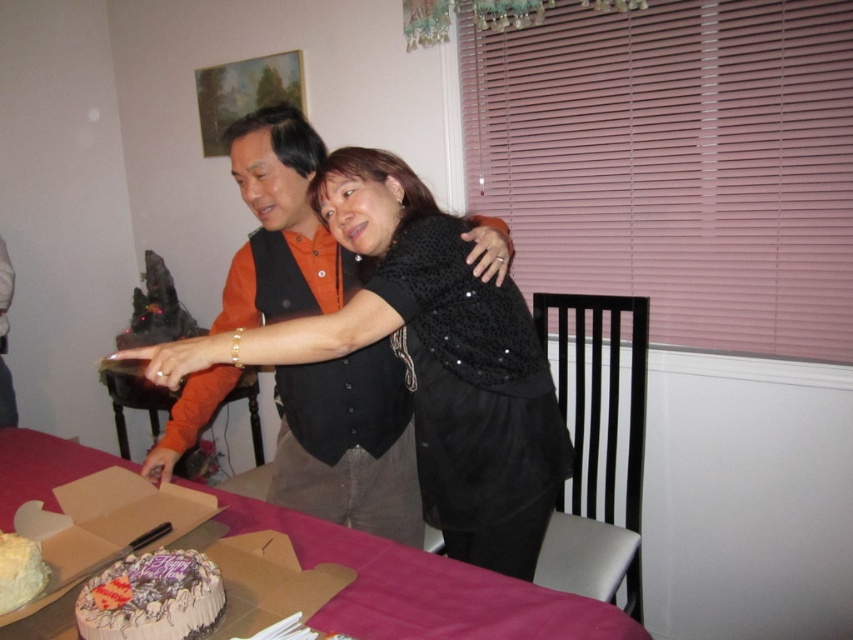
Question: Which of these objects is positioned closest to the chocolate frosted cake at center?

Choices:
 (A) pink fabric table at center
 (B) white frosted cake at lower left

Answer: (B)

Question: Does chocolate frosted cake at center appear under white frosted cake at lower left?

Choices:
 (A) yes
 (B) no

Answer: (A)

Question: Is pink fabric table at center wider than chocolate frosted cake at center?

Choices:
 (A) no
 (B) yes

Answer: (B)

Question: Which object is positioned farthest from the pink fabric table at center?

Choices:
 (A) black sequined dress at center
 (B) chocolate frosted cake at center
 (C) white frosted cake at lower left

Answer: (C)

Question: Does black sequined dress at center appear over white frosted cake at lower left?

Choices:
 (A) yes
 (B) no

Answer: (A)

Question: Based on their relative distances, which object is nearer to the pink fabric table at center?

Choices:
 (A) black sequined dress at center
 (B) chocolate frosted cake at center

Answer: (B)